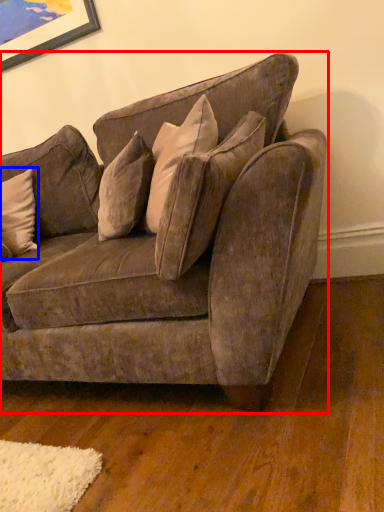
Question: Among these objects, which one is nearest to the camera, studio couch (highlighted by a red box) or pillow (highlighted by a blue box)?

Choices:
 (A) studio couch
 (B) pillow

Answer: (A)